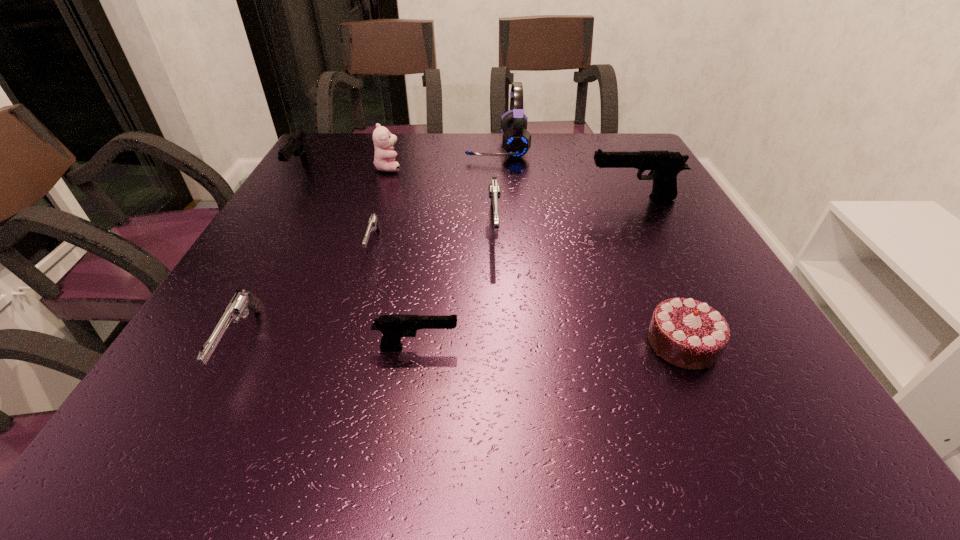
Where is `pistol that is the fourth nearest to the tallest pistol`? Image resolution: width=960 pixels, height=540 pixels. pistol that is the fourth nearest to the tallest pistol is located at coordinates (297, 145).

Choose which pistol is the second nearest neighbor to the smallest silver pistol. Please provide its 2D coordinates. Your answer should be formatted as a tuple, i.e. [(x, y)], where the tuple contains the x and y coordinates of a point satisfying the conditions above.

[(393, 327)]

Locate an element on the screen. This screenshot has height=540, width=960. the closest black pistol relative to the chocolate chocolate cake is located at coordinates (393, 327).

The width and height of the screenshot is (960, 540). What are the coordinates of `black pistol that is the second closest to the smallest black pistol` in the screenshot? It's located at (297, 145).

This screenshot has height=540, width=960. In order to click on silver pistol that is the closest one to the fifth pistol from left to right in this screenshot , I will do `click(373, 224)`.

At what (x,y) coordinates should I click in order to perform the action: click on silver pistol that is the second closest to the chocolate cake. Please return your answer as a coordinate pair (x, y). This screenshot has height=540, width=960. Looking at the image, I should click on (373, 224).

Find the location of a particular element. free point that satisfies the following two spatial constraints: 1. on the front-facing side of the rightmost pistol; 2. on the front-facing side of the second smallest silver pistol is located at coordinates tap(707, 342).

The height and width of the screenshot is (540, 960). Find the location of `vacant space that satisfies the following two spatial constraints: 1. on the ear cushions of the tallest object; 2. on the back side of the chocolate chocolate cake`. vacant space that satisfies the following two spatial constraints: 1. on the ear cushions of the tallest object; 2. on the back side of the chocolate chocolate cake is located at coordinates (510, 343).

The image size is (960, 540). Find the location of `vacant space that satisfies the following two spatial constraints: 1. on the front-facing side of the biggest black pistol; 2. on the front-facing side of the biggest silver pistol`. vacant space that satisfies the following two spatial constraints: 1. on the front-facing side of the biggest black pistol; 2. on the front-facing side of the biggest silver pistol is located at coordinates (648, 227).